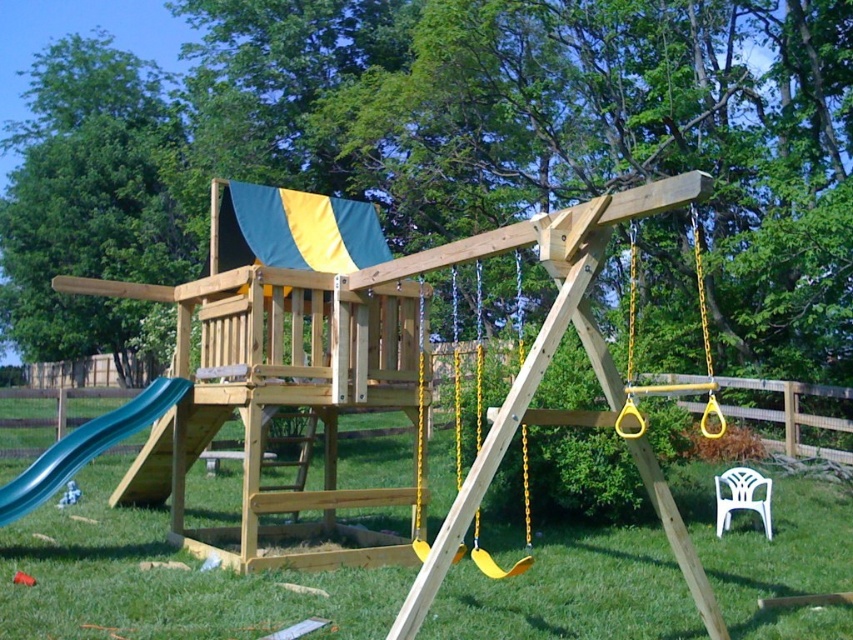
Can you confirm if yellow plastic swing at center is bigger than white plastic chair at lower right?

Yes, yellow plastic swing at center is bigger than white plastic chair at lower right.

Which of these two, yellow plastic swing at center or white plastic chair at lower right, stands taller?

yellow plastic swing at center is taller.

Who is more distant from viewer, (474, 380) or (718, 500)?

The point (474, 380) is behind.

In order to click on yellow plastic swing at center in this screenshot , I will do `click(523, 524)`.

Does wooden swing set at center have a smaller size compared to yellow plastic swing at center?

Correct, wooden swing set at center occupies less space than yellow plastic swing at center.

Is wooden swing set at center to the left of yellow plastic swing at center from the viewer's perspective?

In fact, wooden swing set at center is to the right of yellow plastic swing at center.

Which is behind, point (838, 493) or point (518, 320)?

The point (518, 320) is more distant.

Find the location of a particular element. The width and height of the screenshot is (853, 640). wooden swing set at center is located at coordinates (161, 580).

Does wooden swing set at center have a greater height compared to white plastic chair at lower right?

No, wooden swing set at center is not taller than white plastic chair at lower right.

Looking at this image, does wooden swing set at center have a greater width compared to white plastic chair at lower right?

In fact, wooden swing set at center might be narrower than white plastic chair at lower right.

Where is `wooden swing set at center`? The width and height of the screenshot is (853, 640). wooden swing set at center is located at coordinates (161, 580).

Find the location of a particular element. wooden swing set at center is located at coordinates (161, 580).